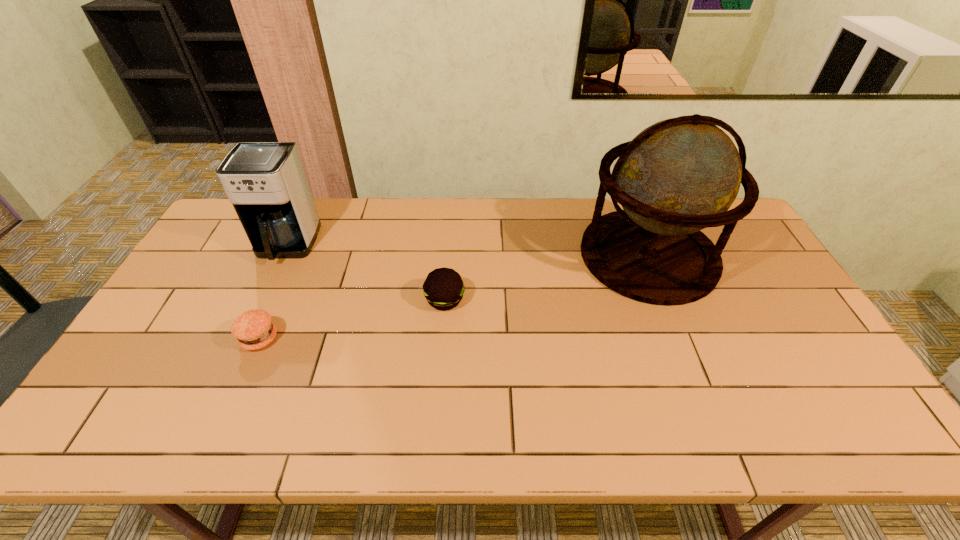
I want to click on free space at the right edge of the desktop, so 777,305.

Identify the location of vacant area between the farther patty and the third shortest object. (x=366, y=273).

The width and height of the screenshot is (960, 540). I want to click on empty space between the third tallest object and the rightmost object, so click(x=546, y=278).

The width and height of the screenshot is (960, 540). Find the location of `empty space that is in between the shorter patty and the coffee maker`. empty space that is in between the shorter patty and the coffee maker is located at coordinates (273, 292).

Identify the location of unoccupied position between the shorter patty and the second tallest object. (273, 292).

This screenshot has height=540, width=960. In order to click on empty space that is in between the third object from left to right and the nearer patty in this screenshot , I will do `click(352, 319)`.

At what (x,y) coordinates should I click in order to perform the action: click on free point between the rightmost object and the coffee maker. Please return your answer as a coordinate pair (x, y). The width and height of the screenshot is (960, 540). Looking at the image, I should click on pyautogui.click(x=468, y=251).

The height and width of the screenshot is (540, 960). Identify the location of unoccupied area between the third object from left to right and the tallest object. (546, 278).

Where is `free space between the right patty and the shortest object`? The height and width of the screenshot is (540, 960). free space between the right patty and the shortest object is located at coordinates (352, 319).

Identify the location of free spot between the coffee maker and the taller patty. (366, 273).